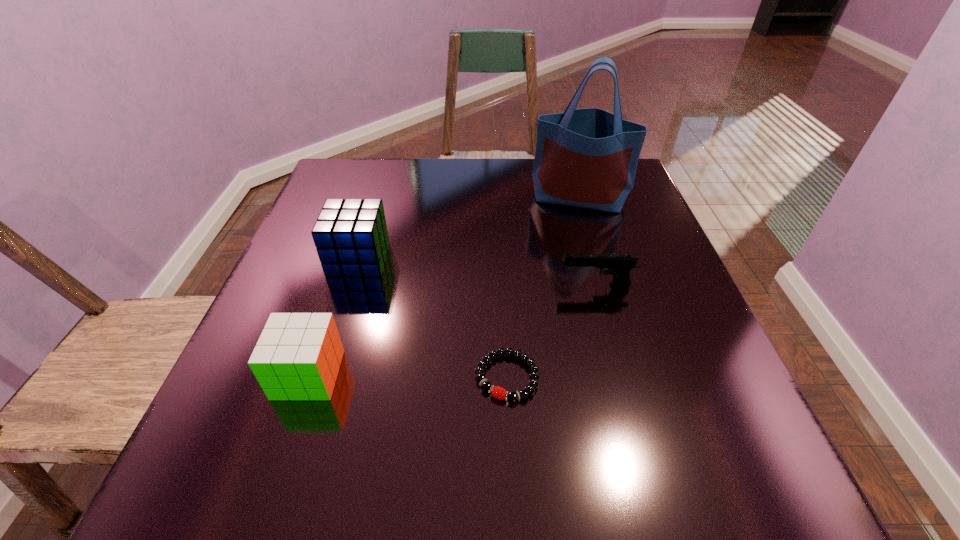
This screenshot has height=540, width=960. I want to click on vacant area located on the right of the fourth nearest object, so click(x=492, y=259).

Identify the location of vacant space located 0.120m on the front of the nearer cube. This screenshot has width=960, height=540. (274, 477).

I want to click on blank space located on the front-facing side of the pistol, so click(530, 286).

Locate an element on the screen. This screenshot has width=960, height=540. vacant space located 0.290m on the front-facing side of the pistol is located at coordinates (417, 286).

Identify the location of vacant space situated on the front-facing side of the pistol. (367, 286).

Image resolution: width=960 pixels, height=540 pixels. In order to click on free space located 0.350m on the left of the third object from left to right in this screenshot , I will do `click(265, 377)`.

Identify the location of object present at the far edge. The image size is (960, 540). (588, 157).

Locate an element on the screen. handbag present at the right edge is located at coordinates (588, 157).

Locate an element on the screen. pistol positioned at the right edge is located at coordinates (619, 265).

Locate an element on the screen. The image size is (960, 540). object that is at the far right corner is located at coordinates (588, 157).